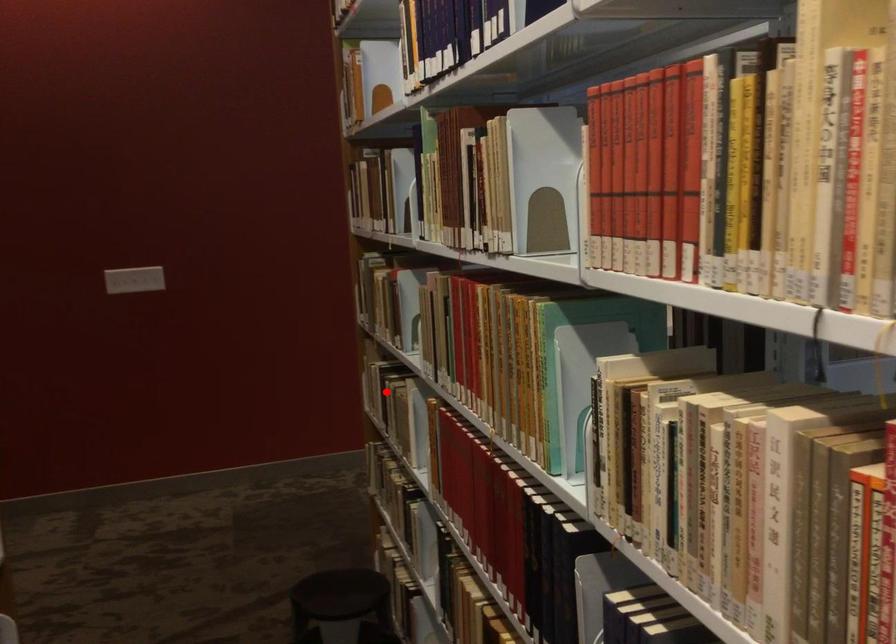
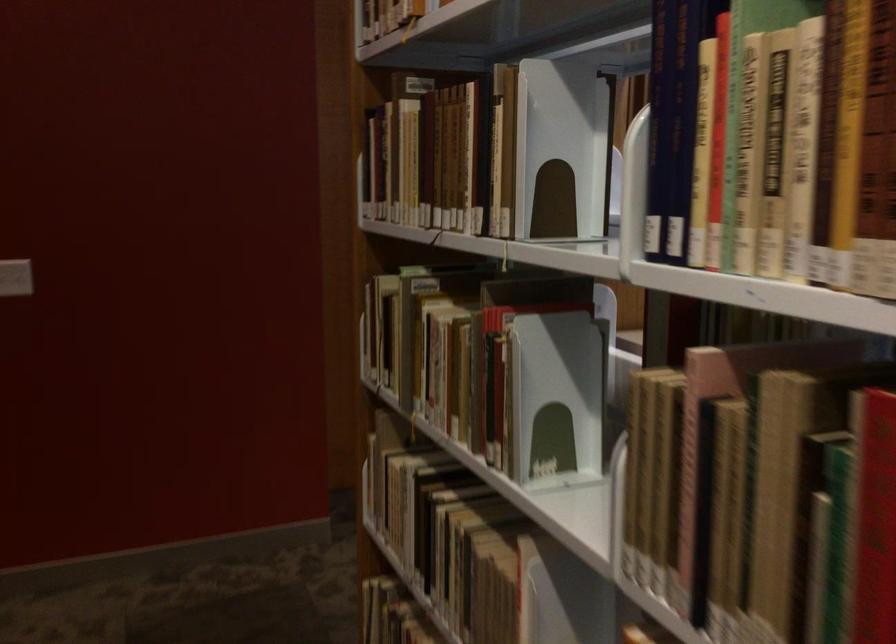
Question: I am providing you with two images of the same scene from different viewpoints. A red point is shown in image1. For the corresponding object point in image2, is it positioned nearer or farther from the camera?

Choices:
 (A) Nearer
 (B) Farther

Answer: (A)